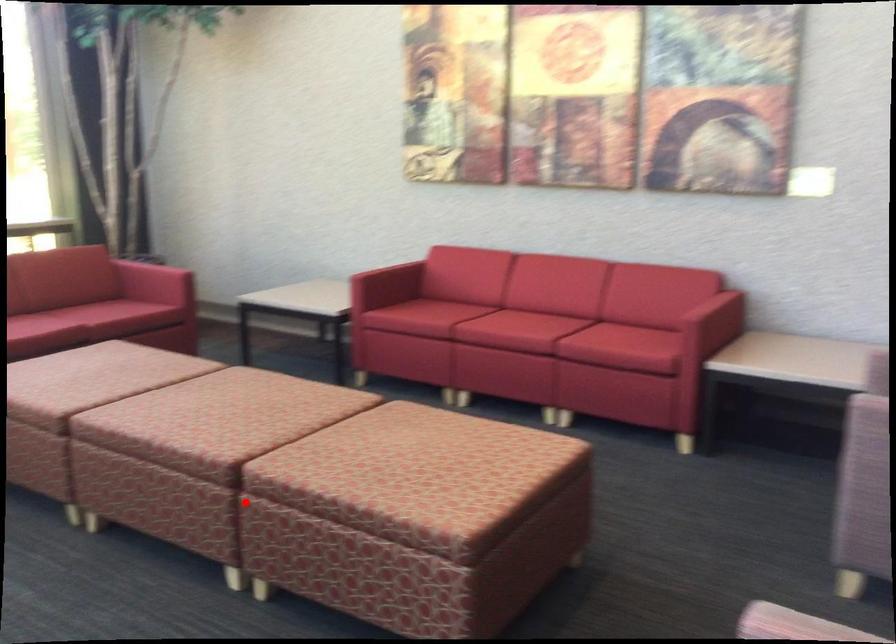
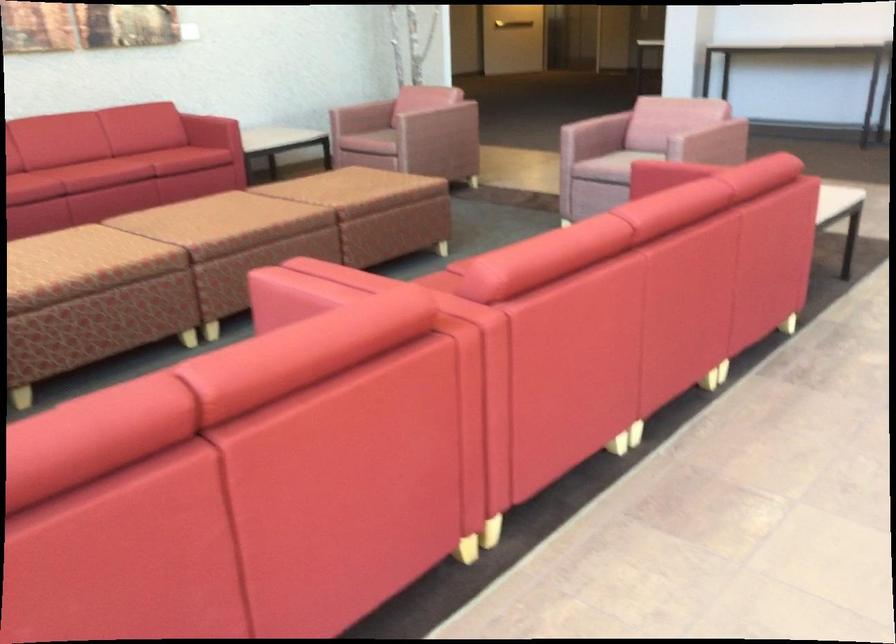
Locate, in the second image, the point that corresponds to the highlighted location in the first image.

(380, 212)